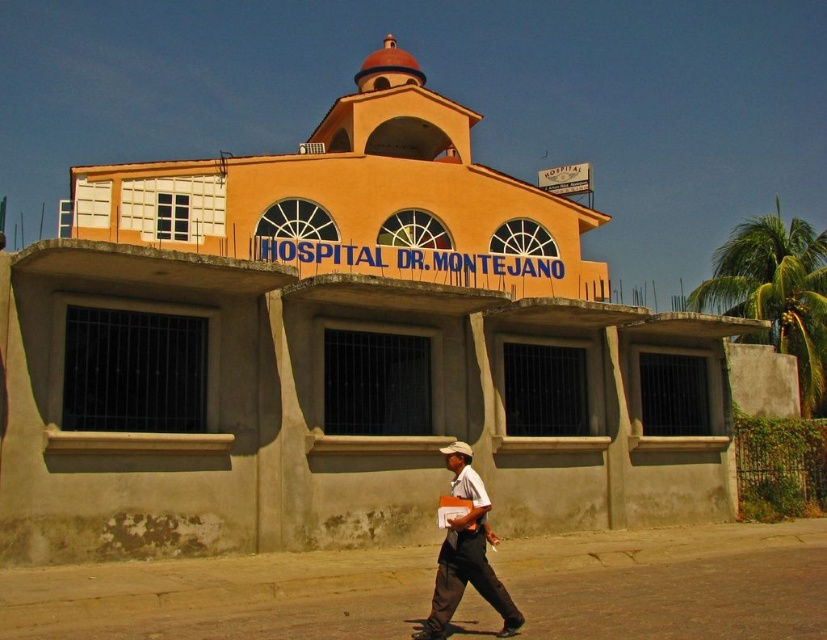
Question: Which object is farther from the camera taking this photo?

Choices:
 (A) brown cotton shirt at lower center
 (B) white matte cowboy hat at center

Answer: (B)

Question: Is brown cotton shirt at lower center positioned at the back of white matte cowboy hat at center?

Choices:
 (A) no
 (B) yes

Answer: (A)

Question: Among these objects, which one is farthest from the camera?

Choices:
 (A) brown cotton shirt at lower center
 (B) white matte cowboy hat at center

Answer: (B)

Question: Does brown cotton shirt at lower center appear on the left side of white matte cowboy hat at center?

Choices:
 (A) yes
 (B) no

Answer: (A)

Question: Among these objects, which one is farthest from the camera?

Choices:
 (A) white matte cowboy hat at center
 (B) brown cotton shirt at lower center

Answer: (A)

Question: Can you confirm if brown cotton shirt at lower center is positioned below white matte cowboy hat at center?

Choices:
 (A) yes
 (B) no

Answer: (A)